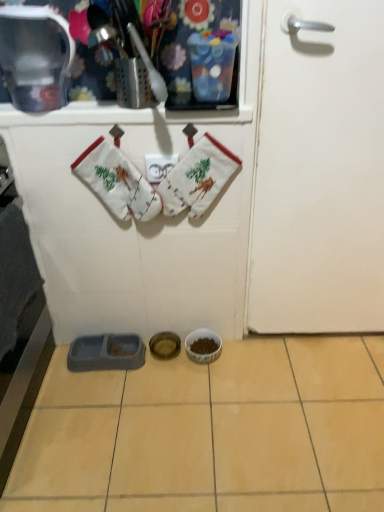
Image resolution: width=384 pixels, height=512 pixels. What are the coordinates of `white cotton oven mitts at upper center, marked as the second baby clothe in a right-to-left arrangement` in the screenshot? It's located at (117, 182).

At what (x,y) coordinates should I click in order to perform the action: click on yellow ceramic tile at center. Please return your answer as a coordinate pair (x, y). Looking at the image, I should click on (211, 432).

Where is `white cotton oven mitts at center, the second baby clothe from the left`? Image resolution: width=384 pixels, height=512 pixels. white cotton oven mitts at center, the second baby clothe from the left is located at coordinates (197, 178).

Locate an element on the screen. white cotton oven mitts at upper center, positioned as the first baby clothe in left-to-right order is located at coordinates (117, 182).

Could you measure the distance between white matte door at right and white cotton oven mitts at upper center, marked as the second baby clothe in a right-to-left arrangement?

The distance of white matte door at right from white cotton oven mitts at upper center, marked as the second baby clothe in a right-to-left arrangement, is 20.05 inches.

Is white matte door at right smaller than white cotton oven mitts at upper center, marked as the second baby clothe in a right-to-left arrangement?

No.

Is white matte door at right oriented towards white cotton oven mitts at upper center, marked as the second baby clothe in a right-to-left arrangement?

No, white matte door at right is not turned towards white cotton oven mitts at upper center, marked as the second baby clothe in a right-to-left arrangement.

Consider the image. Between white matte door at right and white cotton oven mitts at upper center, marked as the second baby clothe in a right-to-left arrangement, which one appears on the right side from the viewer's perspective?

From the viewer's perspective, white matte door at right appears more on the right side.

Is yellow ceramic tile at center placed right next to white cotton oven mitts at center, acting as the 1th baby clothe starting from the right?

There is a gap between yellow ceramic tile at center and white cotton oven mitts at center, acting as the 1th baby clothe starting from the right.

Looking at the image, does yellow ceramic tile at center seem bigger or smaller compared to white cotton oven mitts at center, acting as the 1th baby clothe starting from the right?

Considering their sizes, yellow ceramic tile at center takes up more space than white cotton oven mitts at center, acting as the 1th baby clothe starting from the right.

From the image's perspective, is yellow ceramic tile at center under white cotton oven mitts at center, the second baby clothe from the left?

Indeed, from the image's perspective, yellow ceramic tile at center is shown beneath white cotton oven mitts at center, the second baby clothe from the left.

Which is in front, yellow ceramic tile at center or white cotton oven mitts at center, acting as the 1th baby clothe starting from the right?

yellow ceramic tile at center is more forward.

Which is in front, point (189, 164) or point (92, 175)?

Positioned in front is point (189, 164).

Who is more distant, white cotton oven mitts at center, acting as the 1th baby clothe starting from the right, or white cotton oven mitts at upper center, marked as the second baby clothe in a right-to-left arrangement?

white cotton oven mitts at center, acting as the 1th baby clothe starting from the right, is further from the camera.

Is white cotton oven mitts at center, acting as the 1th baby clothe starting from the right, completely or partially outside of white cotton oven mitts at upper center, marked as the second baby clothe in a right-to-left arrangement?

white cotton oven mitts at center, acting as the 1th baby clothe starting from the right, lies outside white cotton oven mitts at upper center, marked as the second baby clothe in a right-to-left arrangement,'s area.

Considering the relative positions of yellow ceramic tile at center and white matte door at right in the image provided, is yellow ceramic tile at center to the left or to the right of white matte door at right?

Clearly, yellow ceramic tile at center is on the left of white matte door at right in the image.

Can you tell me how much yellow ceramic tile at center and white matte door at right differ in facing direction?

The angular difference between yellow ceramic tile at center and white matte door at right is 89.7 degrees.

Is yellow ceramic tile at center looking in the opposite direction of white matte door at right?

No, white matte door at right is not at the back of yellow ceramic tile at center.

Find the location of a particular element. Image resolution: width=384 pixels, height=512 pixels. door above the yellow ceramic tile at center (from the image's perspective) is located at coordinates (319, 170).

Who is taller, white cotton oven mitts at upper center, positioned as the first baby clothe in left-to-right order, or white matte door at right?

Standing taller between the two is white matte door at right.

Locate an element on the screen. The image size is (384, 512). the 1st baby clothe positioned above the white matte door at right (from a real-world perspective) is located at coordinates coord(117,182).

Does white cotton oven mitts at upper center, marked as the second baby clothe in a right-to-left arrangement, appear on the right side of white matte door at right?

No, white cotton oven mitts at upper center, marked as the second baby clothe in a right-to-left arrangement, is not to the right of white matte door at right.

From the image's perspective, relative to white matte door at right, is white cotton oven mitts at upper center, marked as the second baby clothe in a right-to-left arrangement, above or below?

white cotton oven mitts at upper center, marked as the second baby clothe in a right-to-left arrangement, is situated higher than white matte door at right in the image.

Is metallic silver container at upper left bigger than white cotton oven mitts at upper center, positioned as the first baby clothe in left-to-right order?

Yes, metallic silver container at upper left is bigger than white cotton oven mitts at upper center, positioned as the first baby clothe in left-to-right order.

From a real-world perspective, is metallic silver container at upper left positioned above or below white cotton oven mitts at upper center, positioned as the first baby clothe in left-to-right order?

From a real-world perspective, metallic silver container at upper left is physically above white cotton oven mitts at upper center, positioned as the first baby clothe in left-to-right order.

From the image's perspective, does metallic silver container at upper left appear higher than white cotton oven mitts at upper center, marked as the second baby clothe in a right-to-left arrangement?

Indeed, from the image's perspective, metallic silver container at upper left is shown above white cotton oven mitts at upper center, marked as the second baby clothe in a right-to-left arrangement.

From the image's perspective, is metallic silver container at upper left above or below white matte door at right?

Clearly, from the image's perspective, metallic silver container at upper left is above white matte door at right.

Is metallic silver container at upper left facing towards white matte door at right?

No, metallic silver container at upper left is not oriented towards white matte door at right.

Where is `door that appears on the right of metallic silver container at upper left`? The height and width of the screenshot is (512, 384). door that appears on the right of metallic silver container at upper left is located at coordinates (319, 170).

Where is `the 1st baby clothe behind the white matte door at right`? the 1st baby clothe behind the white matte door at right is located at coordinates (117, 182).

Locate an element on the screen. ceramic tile below the white cotton oven mitts at center, the second baby clothe from the left (from the image's perspective) is located at coordinates (211, 432).

Which object lies nearer to the anchor point white cotton oven mitts at upper center, marked as the second baby clothe in a right-to-left arrangement, white matte door at right or white cotton oven mitts at center, acting as the 1th baby clothe starting from the right?

white cotton oven mitts at center, acting as the 1th baby clothe starting from the right, lies closer to white cotton oven mitts at upper center, marked as the second baby clothe in a right-to-left arrangement, than the other object.

Looking at the image, which one is located closer to white matte door at right, yellow ceramic tile at center or white cotton oven mitts at center, the second baby clothe from the left?

white cotton oven mitts at center, the second baby clothe from the left, is closer to white matte door at right.

Based on their spatial positions, is white cotton oven mitts at center, the second baby clothe from the left, or yellow ceramic tile at center closer to white cotton oven mitts at upper center, marked as the second baby clothe in a right-to-left arrangement?

The object closer to white cotton oven mitts at upper center, marked as the second baby clothe in a right-to-left arrangement, is white cotton oven mitts at center, the second baby clothe from the left.

Estimate the real-world distances between objects in this image. Which object is closer to metallic silver container at upper left, white cotton oven mitts at center, acting as the 1th baby clothe starting from the right, or white cotton oven mitts at upper center, positioned as the first baby clothe in left-to-right order?

white cotton oven mitts at upper center, positioned as the first baby clothe in left-to-right order, lies closer to metallic silver container at upper left than the other object.

Which object lies nearer to the anchor point white matte door at right, yellow ceramic tile at center or white cotton oven mitts at upper center, positioned as the first baby clothe in left-to-right order?

Among the two, white cotton oven mitts at upper center, positioned as the first baby clothe in left-to-right order, is located nearer to white matte door at right.

Looking at the image, which one is located closer to white cotton oven mitts at center, the second baby clothe from the left, metallic silver container at upper left or white cotton oven mitts at upper center, positioned as the first baby clothe in left-to-right order?

white cotton oven mitts at upper center, positioned as the first baby clothe in left-to-right order, is closer to white cotton oven mitts at center, the second baby clothe from the left.

From the image, which object appears to be farther from white cotton oven mitts at upper center, positioned as the first baby clothe in left-to-right order, yellow ceramic tile at center or white cotton oven mitts at center, the second baby clothe from the left?

yellow ceramic tile at center is further to white cotton oven mitts at upper center, positioned as the first baby clothe in left-to-right order.

Considering their positions, is white cotton oven mitts at center, acting as the 1th baby clothe starting from the right, positioned closer to metallic silver container at upper left than white matte door at right?

white cotton oven mitts at center, acting as the 1th baby clothe starting from the right.

This screenshot has height=512, width=384. I want to click on door between white cotton oven mitts at center, the second baby clothe from the left, and yellow ceramic tile at center vertically, so click(319, 170).

The width and height of the screenshot is (384, 512). I want to click on baby clothe located between white cotton oven mitts at upper center, positioned as the first baby clothe in left-to-right order, and white matte door at right in the left-right direction, so click(197, 178).

You are a GUI agent. You are given a task and a screenshot of the screen. Output one action in this format:
    pyautogui.click(x=<x>, y=<y>)
    Task: Click on the baby clothe situated between metallic silver container at upper left and white cotton oven mitts at center, the second baby clothe from the left, from left to right
    
    Given the screenshot: What is the action you would take?
    pyautogui.click(x=117, y=182)

Identify the location of door between white cotton oven mitts at upper center, marked as the second baby clothe in a right-to-left arrangement, and yellow ceramic tile at center vertically. The height and width of the screenshot is (512, 384). (319, 170).